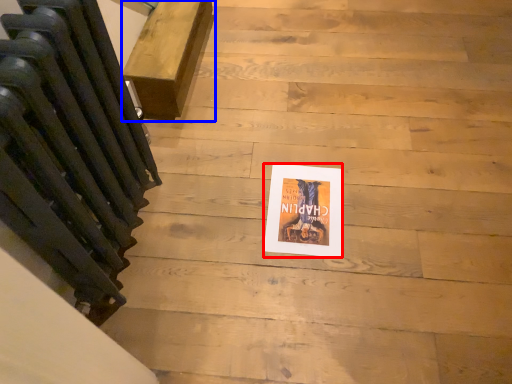
Question: Among these objects, which one is farthest to the camera, flyer (highlighted by a red box) or furniture (highlighted by a blue box)?

Choices:
 (A) flyer
 (B) furniture

Answer: (B)